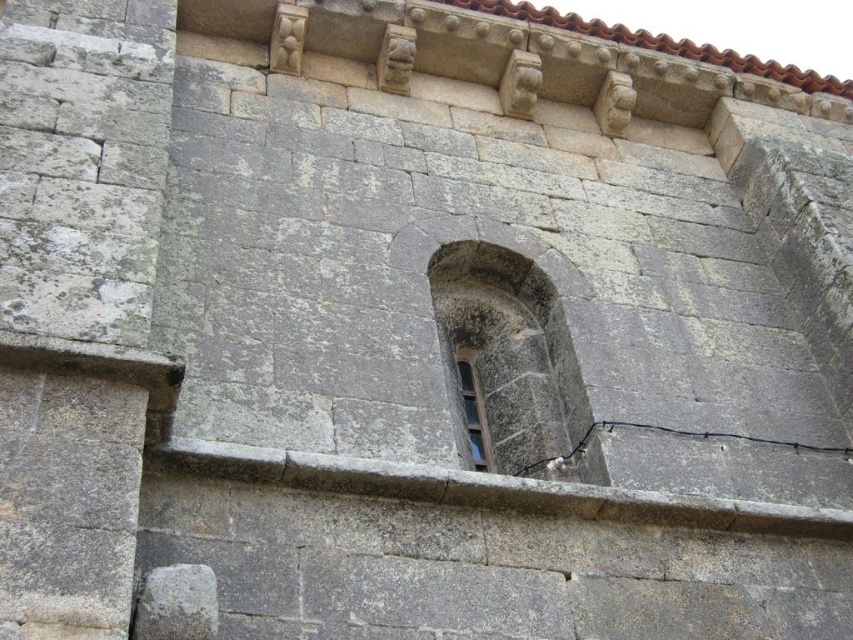
Question: Which of the following is the farthest from the observer?

Choices:
 (A) (573, 456)
 (B) (473, 449)

Answer: (B)

Question: Is black rubber wire at lower center in front of clear glass window at upper center?

Choices:
 (A) no
 (B) yes

Answer: (B)

Question: Does black rubber wire at lower center come in front of clear glass window at upper center?

Choices:
 (A) no
 (B) yes

Answer: (B)

Question: Can you confirm if black rubber wire at lower center is bigger than clear glass window at upper center?

Choices:
 (A) yes
 (B) no

Answer: (A)